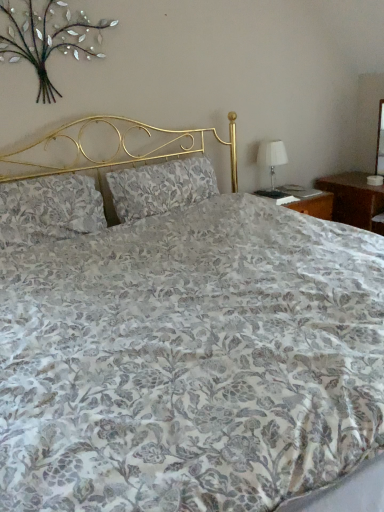
Question: From the image's perspective, is white fabric table lamp at right over metallic silver floral arrangement at upper left?

Choices:
 (A) yes
 (B) no

Answer: (B)

Question: Is white fabric table lamp at right positioned beyond the bounds of metallic silver floral arrangement at upper left?

Choices:
 (A) no
 (B) yes

Answer: (B)

Question: Is white fabric table lamp at right smaller than metallic silver floral arrangement at upper left?

Choices:
 (A) yes
 (B) no

Answer: (B)

Question: Does white fabric table lamp at right have a lesser height compared to metallic silver floral arrangement at upper left?

Choices:
 (A) no
 (B) yes

Answer: (B)

Question: Is metallic silver floral arrangement at upper left at the back of white fabric table lamp at right?

Choices:
 (A) no
 (B) yes

Answer: (A)

Question: Is white fabric table lamp at right inside the boundaries of metallic silver floral arrangement at upper left, or outside?

Choices:
 (A) inside
 (B) outside

Answer: (B)

Question: From a real-world perspective, relative to metallic silver floral arrangement at upper left, is white fabric table lamp at right vertically above or below?

Choices:
 (A) above
 (B) below

Answer: (B)

Question: Considering the positions of point (281, 151) and point (23, 29), is point (281, 151) closer or farther from the camera than point (23, 29)?

Choices:
 (A) closer
 (B) farther

Answer: (B)

Question: Considering the positions of white fabric table lamp at right and metallic silver floral arrangement at upper left in the image, is white fabric table lamp at right taller or shorter than metallic silver floral arrangement at upper left?

Choices:
 (A) short
 (B) tall

Answer: (A)

Question: Is point (54, 201) positioned closer to the camera than point (84, 50)?

Choices:
 (A) farther
 (B) closer

Answer: (B)

Question: Looking at the image, does floral fabric pillow at left, which is the first pillow in left-to-right order, seem bigger or smaller compared to metallic silver floral arrangement at upper left?

Choices:
 (A) small
 (B) big

Answer: (B)

Question: Is floral fabric pillow at left, which is the first pillow in left-to-right order, wider or thinner than metallic silver floral arrangement at upper left?

Choices:
 (A) wide
 (B) thin

Answer: (A)

Question: Visually, is floral fabric pillow at left, which is the first pillow in left-to-right order, positioned to the left or to the right of metallic silver floral arrangement at upper left?

Choices:
 (A) right
 (B) left

Answer: (B)

Question: In terms of height, does metallic silver floral arrangement at upper left look taller or shorter compared to white fabric table lamp at right?

Choices:
 (A) tall
 (B) short

Answer: (A)

Question: From a real-world perspective, relative to white fabric table lamp at right, is metallic silver floral arrangement at upper left vertically above or below?

Choices:
 (A) above
 (B) below

Answer: (A)